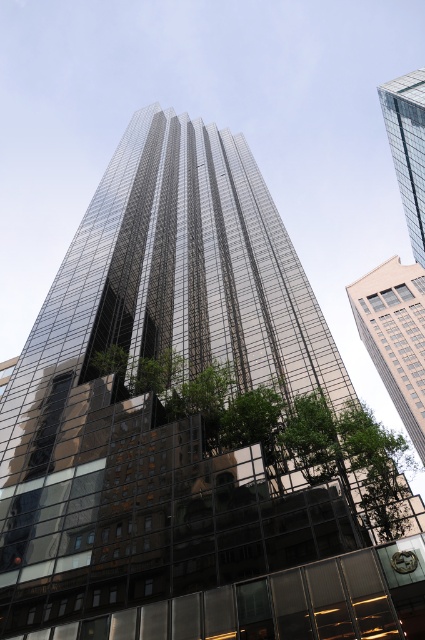
Question: Is green leafy tree at center to the right of glassy reflective skyscraper at upper right from the viewer's perspective?

Choices:
 (A) no
 (B) yes

Answer: (A)

Question: Which object is farther from the camera taking this photo?

Choices:
 (A) glassy reflective skyscraper at upper right
 (B) green leafy tree at center

Answer: (A)

Question: Can you confirm if green leafy tree at center is positioned above beige glass building at right?

Choices:
 (A) no
 (B) yes

Answer: (B)

Question: Which point is farther to the camera?

Choices:
 (A) (401, 188)
 (B) (418, 397)
 (C) (170, 349)

Answer: (B)

Question: Which object is closer to the camera taking this photo?

Choices:
 (A) beige glass building at right
 (B) green leafy tree at center
 (C) glassy reflective skyscraper at upper right

Answer: (B)

Question: Does green leafy tree at center have a lesser width compared to beige glass building at right?

Choices:
 (A) yes
 (B) no

Answer: (A)